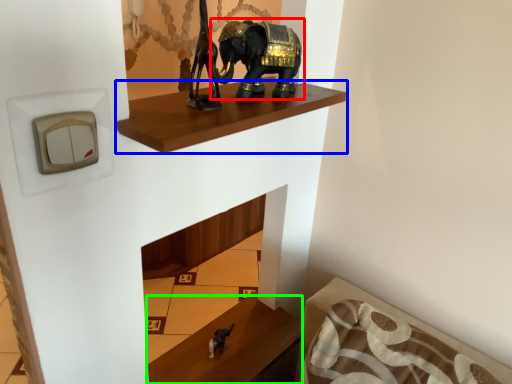
Question: Which object is the farthest from elephant (highlighted by a red box)? Choose among these: shelf (highlighted by a blue box) or furniture (highlighted by a green box).

Choices:
 (A) shelf
 (B) furniture

Answer: (B)